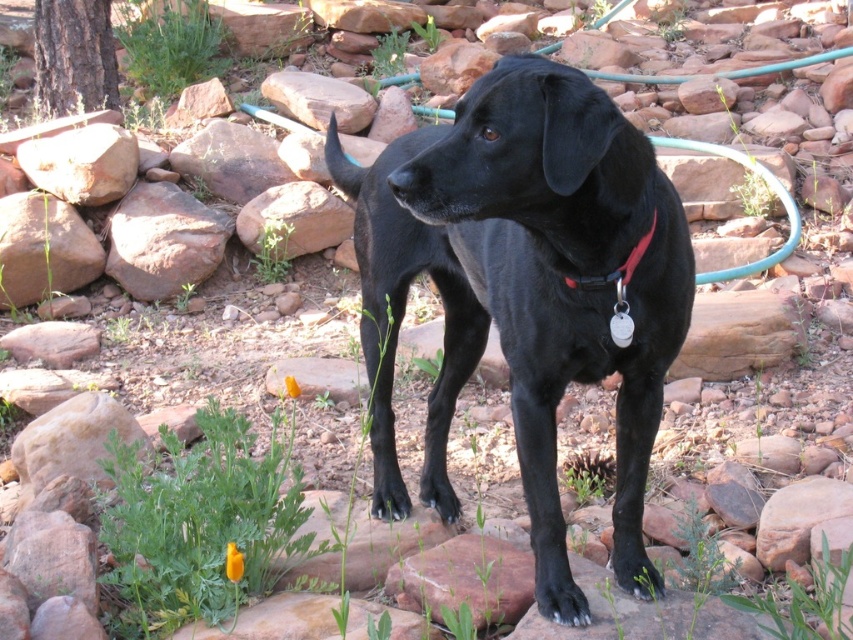
Based on the photo, you are a photographer trying to capture the black matte dog at center and the smooth brown rock at upper left in the same frame. Based on their heights, which one should you focus on first to ensure both are in focus?

The black matte dog at center is taller than the smooth brown rock at upper left. To ensure both are in focus, you should focus on the black matte dog at center first since it is taller and will require adjusting the depth of field to include the shorter rock.

You are a hiker who found a green rubber hose at upper center and a red nylon collar at center. Which object is wider?

The green rubber hose at upper center is wider than the red nylon collar at center.

You are a photographer trying to capture the black matte dog at center and the smooth brown rock at upper left in a single frame. Which object is positioned closer to your camera?

The black matte dog at center is closer to the viewer than the smooth brown rock at upper left, so the dog will appear closer to the camera in the photo.